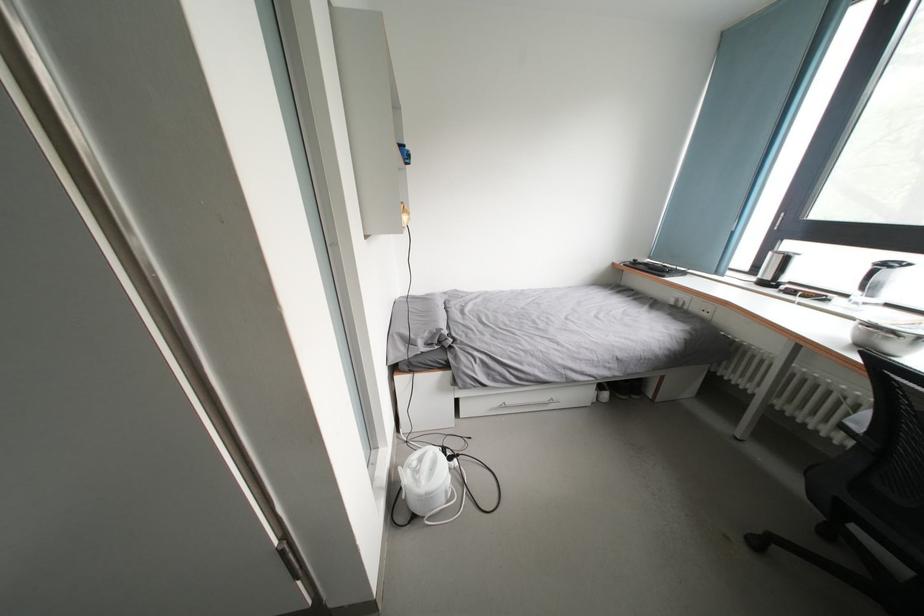
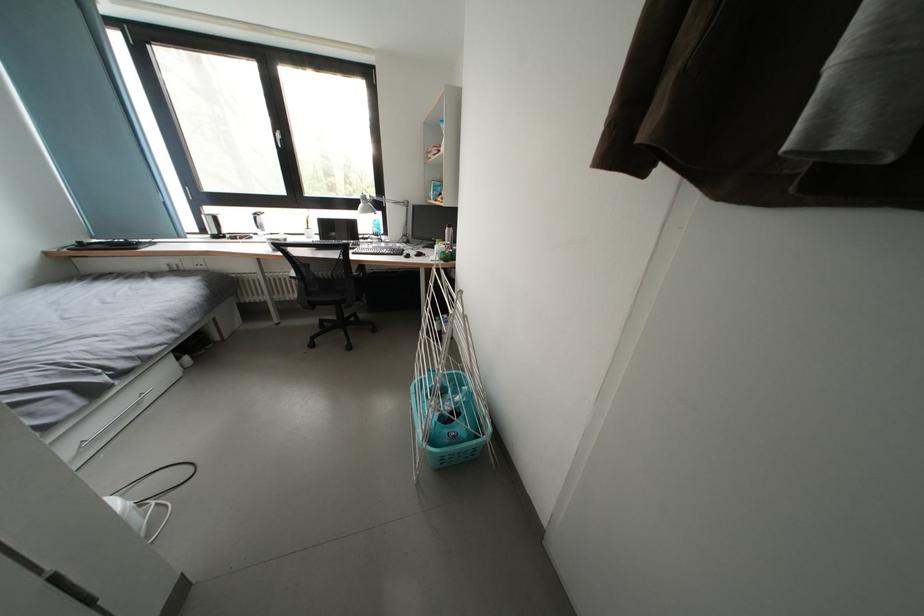
In the scene shown: How did the camera likely rotate?

The camera rotated toward right-down.